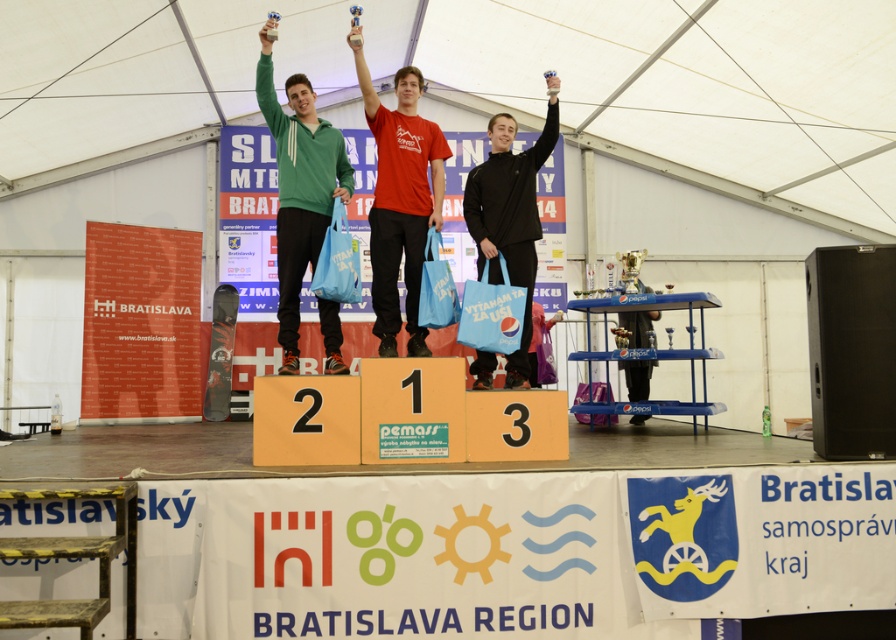
Is matte red t-shirt at center to the left of blue plastic shelf at center from the viewer's perspective?

Indeed, matte red t-shirt at center is positioned on the left side of blue plastic shelf at center.

How distant is matte red t-shirt at center from blue plastic shelf at center?

6.86 feet

Between point (410, 246) and point (672, 355), which one is positioned in front?

Positioned in front is point (410, 246).

You are a GUI agent. You are given a task and a screenshot of the screen. Output one action in this format:
    pyautogui.click(x=<x>, y=<y>)
    Task: Click on the matte red t-shirt at center
    This screenshot has height=640, width=896.
    Given the screenshot: What is the action you would take?
    pyautogui.click(x=401, y=198)

Consider the image. Which of these two, black matte jacket at center or blue plastic shelf at center, stands shorter?

blue plastic shelf at center is shorter.

Can you confirm if black matte jacket at center is smaller than blue plastic shelf at center?

Correct, black matte jacket at center occupies less space than blue plastic shelf at center.

Is point (474, 170) less distant than point (702, 356)?

That is True.

Find the location of a particular element. black matte jacket at center is located at coordinates (510, 214).

Is matte green hoodie at center above blue plastic shelf at center?

Correct, matte green hoodie at center is located above blue plastic shelf at center.

I want to click on matte green hoodie at center, so click(x=299, y=186).

Who is more forward, [283,241] or [694,413]?

Point [283,241] is in front.

The width and height of the screenshot is (896, 640). Find the location of `matte green hoodie at center`. matte green hoodie at center is located at coordinates (299, 186).